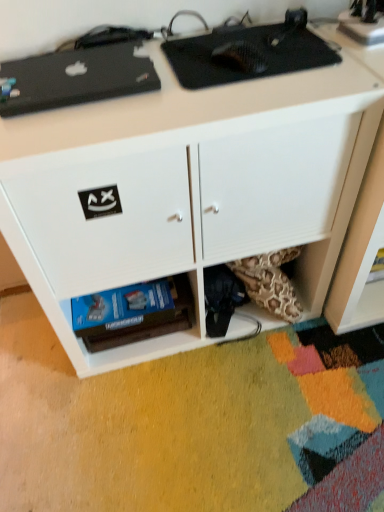
The width and height of the screenshot is (384, 512). In order to click on free spot in front of black matte laptop at upper left, the third appliance positioned from the right in this screenshot , I will do `click(79, 128)`.